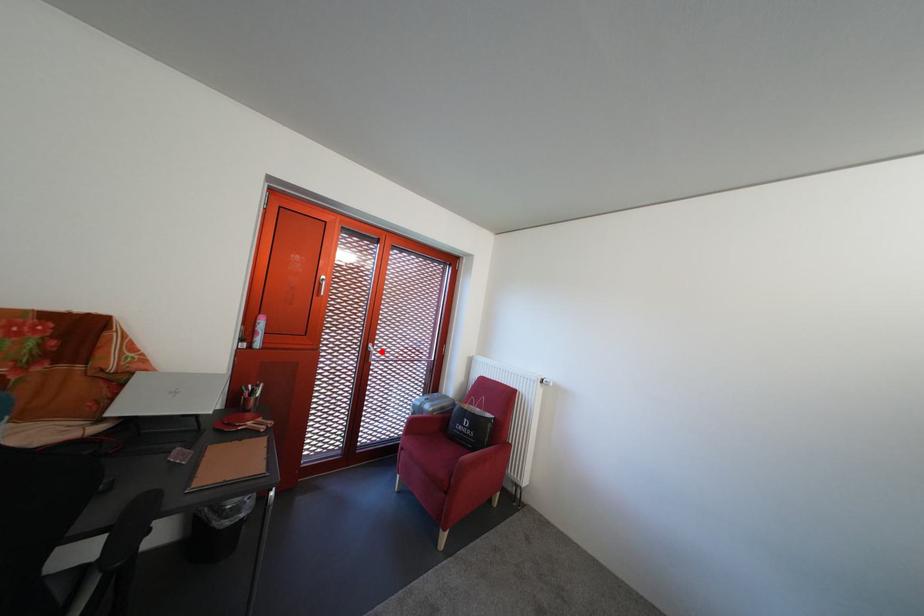
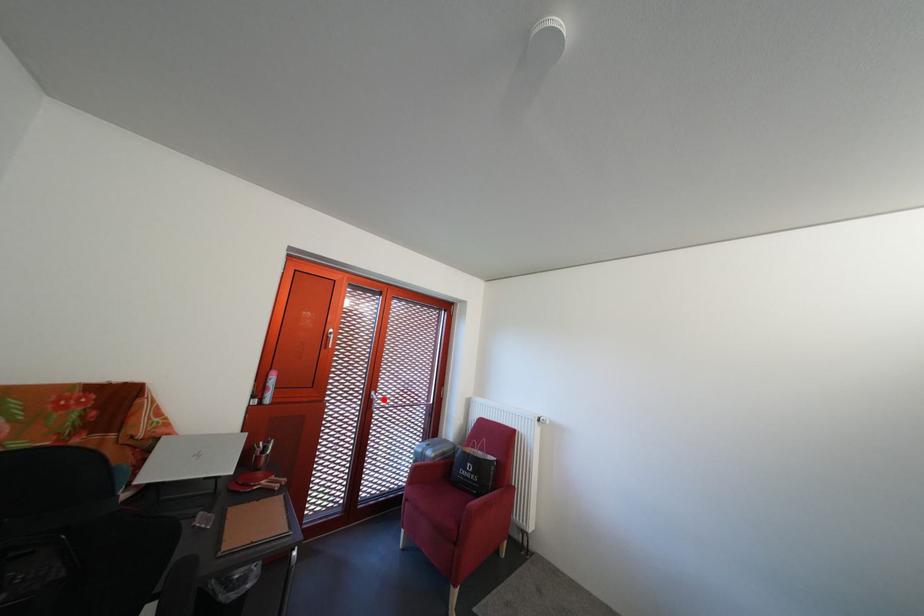
I am providing you with two images of the same scene from different viewpoints. A red point is marked on the first image and another point is marked on the second image. Do the highlighted points in image1 and image2 indicate the same real-world spot?

Yes